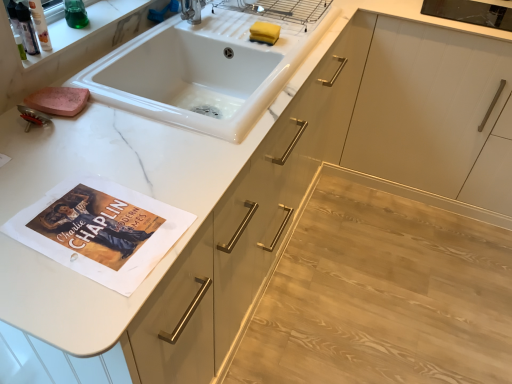
What do you see at coordinates (383, 291) in the screenshot? I see `light wood floor at lower right` at bounding box center [383, 291].

Locate an element on the screen. This screenshot has width=512, height=384. white glossy sink at upper center is located at coordinates (202, 72).

Find the location of a particular element. Image resolution: width=512 pixels, height=384 pixels. light wood floor at lower right is located at coordinates (383, 291).

Would you say white marble shelf at upper left is part of yellow sponge at sink's contents?

No, white marble shelf at upper left is not a part of yellow sponge at sink.

From the image's perspective, is yellow sponge at sink on top of white marble shelf at upper left?

Yes, from the image's perspective, yellow sponge at sink is above white marble shelf at upper left.

Is point (257, 22) positioned before point (90, 21)?

No, (257, 22) is further to viewer.

Is yellow sponge at sink in front of white marble shelf at upper left?

No, it is not.

Could you tell me if light wood floor at lower right is facing white glossy sink at upper center?

No, light wood floor at lower right is not turned towards white glossy sink at upper center.

Is light wood floor at lower right directly adjacent to white glossy sink at upper center?

No, light wood floor at lower right is not making contact with white glossy sink at upper center.

Is light wood floor at lower right at the left side of white glossy sink at upper center?

No, light wood floor at lower right is not to the left of white glossy sink at upper center.

Can you confirm if light wood floor at lower right is smaller than white glossy sink at upper center?

Yes.

From the image's perspective, which is below, light wood floor at lower right or white marble shelf at upper left?

light wood floor at lower right appears lower in the image.

Is white marble shelf at upper left at the back of light wood floor at lower right?

No, light wood floor at lower right is not facing the opposite direction of white marble shelf at upper left.

Considering the relative sizes of light wood floor at lower right and white marble shelf at upper left in the image provided, is light wood floor at lower right smaller than white marble shelf at upper left?

Incorrect, light wood floor at lower right is not smaller in size than white marble shelf at upper left.

Find the location of a particular element. Image resolution: width=512 pixels, height=384 pixels. plain lying on the right of white marble shelf at upper left is located at coordinates (383, 291).

Looking at their sizes, would you say white glossy sink at upper center is wider or thinner than light wood floor at lower right?

In the image, white glossy sink at upper center appears to be more narrow than light wood floor at lower right.

Which is in front, white glossy sink at upper center or light wood floor at lower right?

Positioned in front is white glossy sink at upper center.

Is white glossy sink at upper center oriented towards light wood floor at lower right?

No, white glossy sink at upper center is not aimed at light wood floor at lower right.

From the picture: Can you confirm if white marble shelf at upper left is wider than white glossy sink at upper center?

Incorrect, the width of white marble shelf at upper left does not surpass that of white glossy sink at upper center.

Is white marble shelf at upper left behind white glossy sink at upper center?

That is True.

In the scene shown: Is white marble shelf at upper left inside the boundaries of white glossy sink at upper center, or outside?

white marble shelf at upper left exists outside the volume of white glossy sink at upper center.

In the image, is white marble shelf at upper left on the left side or the right side of white glossy sink at upper center?

From the image, it's evident that white marble shelf at upper left is to the left of white glossy sink at upper center.

Considering the relative sizes of white marble shelf at upper left and yellow sponge at sink in the image provided, is white marble shelf at upper left bigger than yellow sponge at sink?

Yes.

At what (x,y) coordinates should I click in order to perform the action: click on shelf that appears in front of the yellow sponge at sink. Please return your answer as a coordinate pair (x, y). Looking at the image, I should click on (86, 27).

Could you tell me if white marble shelf at upper left is turned towards yellow sponge at sink?

No, white marble shelf at upper left is not turned towards yellow sponge at sink.

Based on the photo, from a real-world perspective, does white marble shelf at upper left sit lower than yellow sponge at sink?

No.

From the image's perspective, which is above, white glossy sink at upper center or yellow sponge at sink?

yellow sponge at sink appears higher in the image.

Is white glossy sink at upper center beside yellow sponge at sink?

white glossy sink at upper center is not next to yellow sponge at sink, and they're not touching.

Is white glossy sink at upper center shorter than yellow sponge at sink?

Incorrect, the height of white glossy sink at upper center does not fall short of that of yellow sponge at sink.

Which point is more forward, (157, 89) or (272, 32)?

The point (272, 32) is more forward.

Where is `soap behind the white marble shelf at upper left`? soap behind the white marble shelf at upper left is located at coordinates (264, 33).

In order to click on plain below the white glossy sink at upper center (from a real-world perspective) in this screenshot , I will do `click(383, 291)`.

Estimate the real-world distances between objects in this image. Which object is further from white marble shelf at upper left, white glossy sink at upper center or light wood floor at lower right?

light wood floor at lower right is further to white marble shelf at upper left.

When comparing their distances from light wood floor at lower right, does white glossy sink at upper center or white marble shelf at upper left seem closer?

white glossy sink at upper center lies closer to light wood floor at lower right than the other object.

Which object lies further to the anchor point light wood floor at lower right, white marble shelf at upper left or white glossy sink at upper center?

Among the two, white marble shelf at upper left is located further to light wood floor at lower right.

Estimate the real-world distances between objects in this image. Which object is further from white glossy sink at upper center, yellow sponge at sink or light wood floor at lower right?

light wood floor at lower right.

Estimate the real-world distances between objects in this image. Which object is further from white marble shelf at upper left, yellow sponge at sink or white glossy sink at upper center?

The object further to white marble shelf at upper left is yellow sponge at sink.

From the image, which object appears to be nearer to white marble shelf at upper left, yellow sponge at sink or light wood floor at lower right?

yellow sponge at sink.

From the image, which object appears to be farther from yellow sponge at sink, white marble shelf at upper left or light wood floor at lower right?

The object further to yellow sponge at sink is light wood floor at lower right.

Based on their spatial positions, is light wood floor at lower right or white glossy sink at upper center further from yellow sponge at sink?

Among the two, light wood floor at lower right is located further to yellow sponge at sink.

I want to click on sink between white marble shelf at upper left and light wood floor at lower right, so click(x=202, y=72).

Image resolution: width=512 pixels, height=384 pixels. I want to click on sink between yellow sponge at sink and light wood floor at lower right from top to bottom, so click(202, 72).

The width and height of the screenshot is (512, 384). Identify the location of shelf between yellow sponge at sink and light wood floor at lower right in the vertical direction. (86, 27).

Locate an element on the screen. sink between white marble shelf at upper left and yellow sponge at sink is located at coordinates (202, 72).